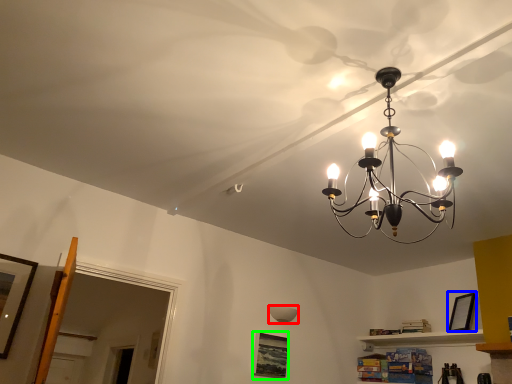
Question: Which is nearer to the lamp (highlighted by a red box)? picture frame (highlighted by a blue box) or picture frame (highlighted by a green box).

Choices:
 (A) picture frame
 (B) picture frame

Answer: (B)